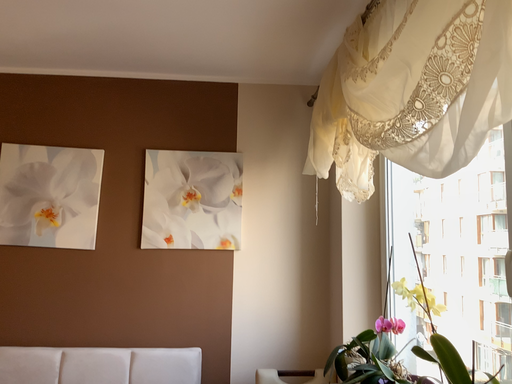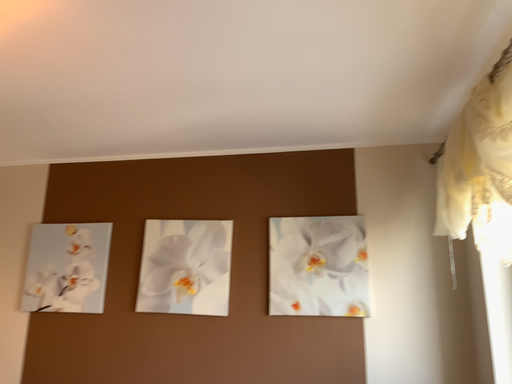
Question: Which way did the camera rotate in the video?

Choices:
 (A) rotated left
 (B) rotated right

Answer: (A)